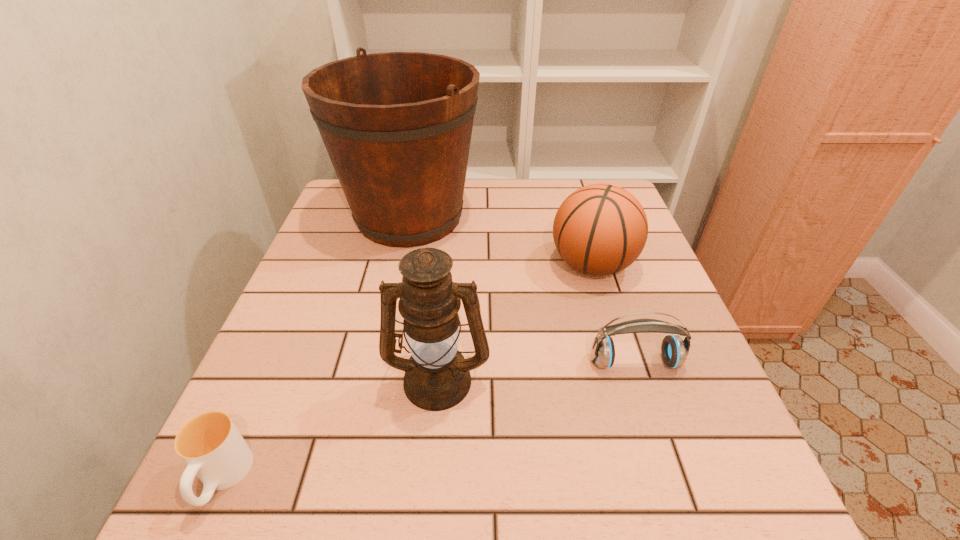
Where is `free space at the left edge`? free space at the left edge is located at coordinates (344, 233).

Identify the location of vacant space at the right edge of the desktop. (699, 387).

Find the location of a particular element. The image size is (960, 540). vacant space at the far left corner of the desktop is located at coordinates (342, 214).

Where is `blank space at the far right corner`? The height and width of the screenshot is (540, 960). blank space at the far right corner is located at coordinates (570, 185).

You are a GUI agent. You are given a task and a screenshot of the screen. Output one action in this format:
    pyautogui.click(x=<x>, y=<y>)
    Task: Click on the free space that is in between the shortest object and the headset
    
    Given the screenshot: What is the action you would take?
    pyautogui.click(x=428, y=421)

Locate an element on the screen. The image size is (960, 540). unoccupied position between the fourth tallest object and the oil lamp is located at coordinates [537, 370].

Where is `free space between the headset and the fourth shortest object`? The image size is (960, 540). free space between the headset and the fourth shortest object is located at coordinates coord(537,370).

At what (x,y) coordinates should I click in order to perform the action: click on vacant point located between the second shortest object and the basketball. Please return your answer as a coordinate pair (x, y). Image resolution: width=960 pixels, height=540 pixels. Looking at the image, I should click on (613, 314).

What are the coordinates of `empty location between the basketball and the fourth shortest object` in the screenshot? It's located at (515, 321).

Find the location of a particular element. blank region between the shortest object and the second tallest object is located at coordinates (330, 429).